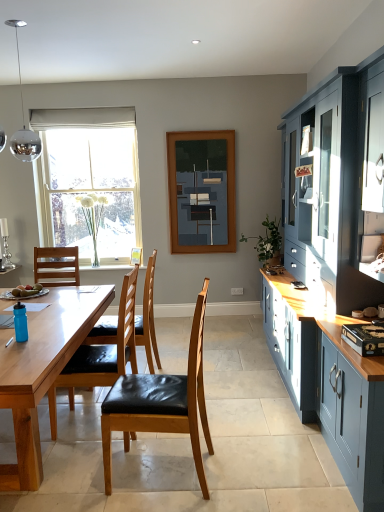
Describe the element at coordinates (101, 355) in the screenshot. I see `wooden chair with black leather seat at left, the 2th chair viewed from the front` at that location.

Consider the image. In order to face clear glass vase at left, should I rotate leftwards or rightwards?

You should look left and rotate roughly 13.368 degrees.

I want to click on clear glass vase at left, so click(x=89, y=182).

Measure the distance between brown leather chair at center, which is counted as the 1th chair, starting from the front, and camera.

2.12 meters.

What is the approximate height of brown leather chair at center, which is counted as the 1th chair, starting from the back?

The height of brown leather chair at center, which is counted as the 1th chair, starting from the back, is 3.74 feet.

This screenshot has width=384, height=512. Find the location of `wooden chair with black leather seat at left, the 2th chair viewed from the front`. wooden chair with black leather seat at left, the 2th chair viewed from the front is located at coordinates (101, 355).

Is brown leather chair at center, which is counted as the 1th chair, starting from the front, at the left side of wooden table at center?

No, brown leather chair at center, which is counted as the 1th chair, starting from the front, is not to the left of wooden table at center.

Locate an element on the screen. The height and width of the screenshot is (512, 384). desk on the left of brown leather chair at center, which is counted as the 1th chair, starting from the front is located at coordinates (42, 372).

Is brown leather chair at center, which is counted as the 1th chair, starting from the front, taller or shorter than wooden table at center?

Clearly, brown leather chair at center, which is counted as the 1th chair, starting from the front, is taller compared to wooden table at center.

Considering the relative sizes of brown leather chair at center, which is the third chair from back to front, and wooden table at center in the image provided, is brown leather chair at center, which is the third chair from back to front, bigger than wooden table at center?

No, brown leather chair at center, which is the third chair from back to front, is not bigger than wooden table at center.

Does polished chrome globe at upper left have a lesser height compared to teal matte water bottle at table left?

Incorrect, the height of polished chrome globe at upper left does not fall short of that of teal matte water bottle at table left.

Considering the relative sizes of polished chrome globe at upper left and teal matte water bottle at table left in the image provided, is polished chrome globe at upper left wider than teal matte water bottle at table left?

Correct, the width of polished chrome globe at upper left exceeds that of teal matte water bottle at table left.

This screenshot has width=384, height=512. Find the location of `teal located underneath the polished chrome globe at upper left (from a real-world perspective)`. teal located underneath the polished chrome globe at upper left (from a real-world perspective) is located at coordinates (20, 322).

Is polished chrome globe at upper left positioned with its back to teal matte water bottle at table left?

No.

Is white plastic power outlet at lower center oriented towards green leafy plant at right?

No, white plastic power outlet at lower center is not oriented towards green leafy plant at right.

Identify the location of houseplant above the white plastic power outlet at lower center (from the image's perspective). (267, 241).

Does white plastic power outlet at lower center contain green leafy plant at right?

That's incorrect, green leafy plant at right is not inside white plastic power outlet at lower center.

Consider the image. From a real-world perspective, is white plastic power outlet at lower center physically located above or below green leafy plant at right?

Clearly, from a real-world perspective, white plastic power outlet at lower center is below green leafy plant at right.

Locate an element on the screen. The image size is (384, 512). window screen that is above the wooden table at center (from a real-world perspective) is located at coordinates (202, 191).

Can you confirm if wooden table at center is wider than dark blue matte painting at center?

Indeed, wooden table at center has a greater width compared to dark blue matte painting at center.

Is point (55, 330) closer to camera compared to point (228, 182)?

Yes, point (55, 330) is in front of point (228, 182).

Can you confirm if wooden table at center is smaller than dark blue matte painting at center?

No.

Between point (103, 118) and point (50, 410), which one is positioned in front?

The point (50, 410) is more forward.

From the image's perspective, does white fabric curtain at upper center appear lower than wooden chair with black leather seat at left, the 2th chair viewed from the front?

No, from the image's perspective, white fabric curtain at upper center is not below wooden chair with black leather seat at left, the 2th chair viewed from the front.

There is a white fabric curtain at upper center. Identify the location of the 3rd chair below it (from a real-world perspective). This screenshot has width=384, height=512. (101, 355).

Is wooden chair with black leather seat at left, the 2th chair viewed from the front, at the back of white fabric curtain at upper center?

white fabric curtain at upper center does not have its back to wooden chair with black leather seat at left, the 2th chair viewed from the front.

Can we say green leafy plant at right lies outside brown leather chair at center, which is counted as the 1th chair, starting from the front?

A: Yes, green leafy plant at right is located beyond the bounds of brown leather chair at center, which is counted as the 1th chair, starting from the front.

Considering the sizes of green leafy plant at right and brown leather chair at center, which is the third chair from back to front, in the image, is green leafy plant at right bigger or smaller than brown leather chair at center, which is the third chair from back to front,?

green leafy plant at right is smaller than brown leather chair at center, which is the third chair from back to front.

Is green leafy plant at right in contact with brown leather chair at center, which is the third chair from back to front?

No, green leafy plant at right is not with brown leather chair at center, which is the third chair from back to front.

Is brown leather chair at center, which is the third chair from back to front, touching blue plastic power plugs and sockets at lower left?

brown leather chair at center, which is the third chair from back to front, and blue plastic power plugs and sockets at lower left are not in contact.

Looking at the image, does brown leather chair at center, which is the third chair from back to front, seem bigger or smaller compared to blue plastic power plugs and sockets at lower left?

brown leather chair at center, which is the third chair from back to front, is bigger than blue plastic power plugs and sockets at lower left.

You are a GUI agent. You are given a task and a screenshot of the screen. Output one action in this format:
    pyautogui.click(x=<x>, y=<y>)
    Task: Click on the 1st chair above the wooden table at center (from the image's perspective)
    This screenshot has width=384, height=512.
    Given the screenshot: What is the action you would take?
    pyautogui.click(x=162, y=402)

In order to click on lamp positioned vertically above the teal matte water bottle at table left (from a real-world perspective) in this screenshot , I will do `click(23, 119)`.

Based on their spatial positions, is blue plastic power plugs and sockets at lower left or teal matte water bottle at table left closer to wooden chair with black leather seat at left, the 2th chair viewed from the front?

teal matte water bottle at table left is closer to wooden chair with black leather seat at left, the 2th chair viewed from the front.

Based on their spatial positions, is brown leather chair at center, the third chair from the front, or matte black plate at table left further from clear glass vase at left?

The object further to clear glass vase at left is brown leather chair at center, the third chair from the front.

Which object lies nearer to the anchor point clear glass vase at left, wooden table at center or brown leather chair at center, which is counted as the 1th chair, starting from the back?

Among the two, brown leather chair at center, which is counted as the 1th chair, starting from the back, is located nearer to clear glass vase at left.

Estimate the real-world distances between objects in this image. Which object is closer to teal matte water bottle at table left, dark blue matte painting at center or wooden table at center?

Among the two, wooden table at center is located nearer to teal matte water bottle at table left.

Looking at this image, which object lies further to the anchor point white plastic power outlet at lower center, matte black plate at table left or white fabric curtain at upper center?

white fabric curtain at upper center lies further to white plastic power outlet at lower center than the other object.

Considering their positions, is white plastic power outlet at lower center positioned further to blue plastic power plugs and sockets at lower left than white fabric curtain at upper center?

white plastic power outlet at lower center.

Considering their positions, is polished chrome globe at upper left positioned further to brown leather chair at center, the third chair from the front, than brown leather chair at center, which is the third chair from back to front?

polished chrome globe at upper left lies further to brown leather chair at center, the third chair from the front, than the other object.

Looking at this image, looking at the image, which one is located further to polished chrome globe at upper left, clear glass vase at left or dark blue matte painting at center?

The object further to polished chrome globe at upper left is dark blue matte painting at center.

Where is `food positioned between brown leather chair at center, which is counted as the 1th chair, starting from the front, and dark blue matte painting at center from near to far`? food positioned between brown leather chair at center, which is counted as the 1th chair, starting from the front, and dark blue matte painting at center from near to far is located at coordinates (26, 291).

I want to click on window screen between matte black plate at table left and clear glass vase at left in the front-back direction, so click(202, 191).

Image resolution: width=384 pixels, height=512 pixels. What are the coordinates of `teal located between blue plastic power plugs and sockets at lower left and green leafy plant at right in the left-right direction` in the screenshot? It's located at (20, 322).

At what (x,y) coordinates should I click in order to perform the action: click on power plugs and sockets between polished chrome globe at upper left and wooden table at center from top to bottom. Please return your answer as a coordinate pair (x, y). Looking at the image, I should click on (6, 321).